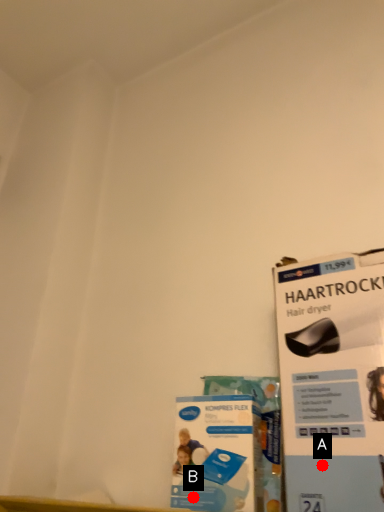
Question: Two points are circled on the image, labeled by A and B beside each circle. Which point is farther from the camera taking this photo?

Choices:
 (A) A is further
 (B) B is further

Answer: (B)